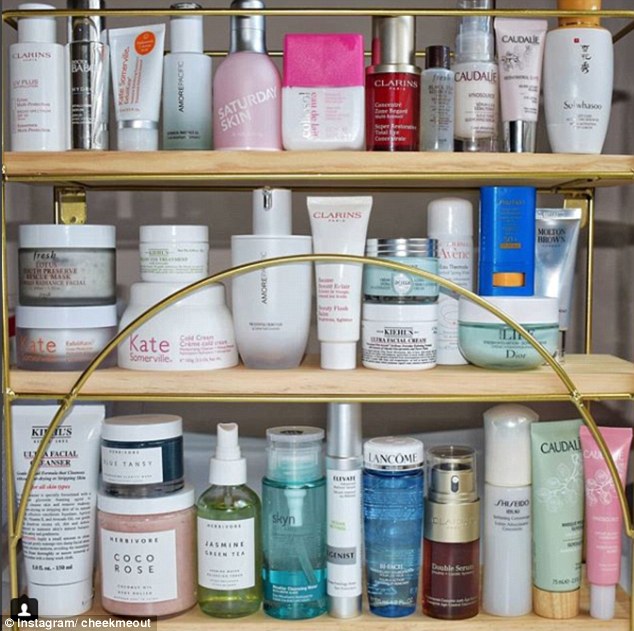
In order to click on center wooden shelf in this screenshot , I will do `click(153, 377)`, `click(281, 380)`, `click(525, 382)`.